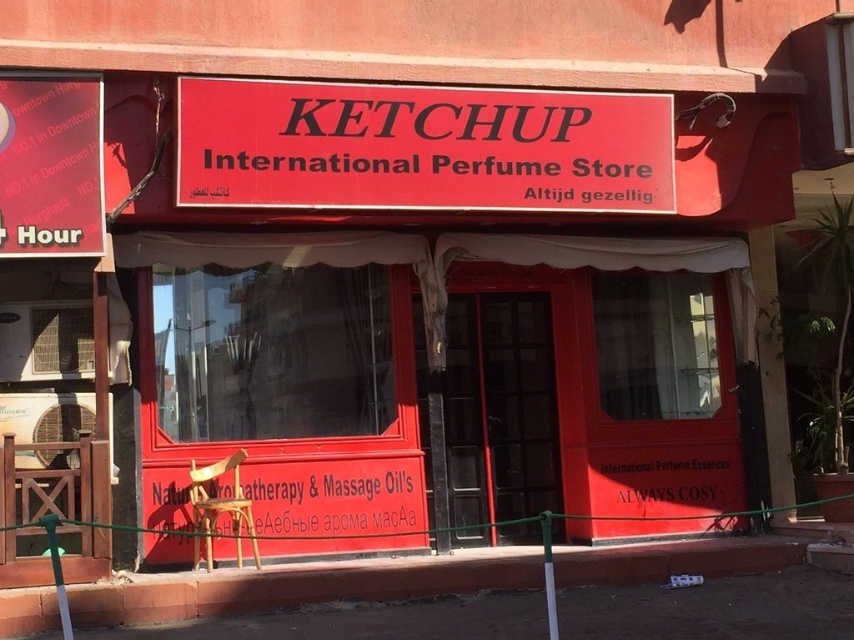
Question: Can you confirm if red matte sign at center is positioned below white matte signboard at center?

Choices:
 (A) no
 (B) yes

Answer: (A)

Question: Which point appears farthest from the camera in this image?

Choices:
 (A) (355, 209)
 (B) (287, 531)

Answer: (B)

Question: Does red matte sign at center appear under white matte signboard at center?

Choices:
 (A) no
 (B) yes

Answer: (A)

Question: Does red matte sign at center have a smaller size compared to white matte signboard at center?

Choices:
 (A) yes
 (B) no

Answer: (B)